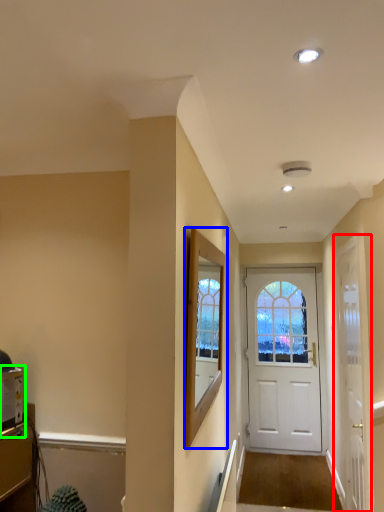
Question: Which object is the farthest from door (highlighted by a red box)? Choose among these: window screen (highlighted by a blue box) or appliance (highlighted by a green box).

Choices:
 (A) window screen
 (B) appliance

Answer: (B)